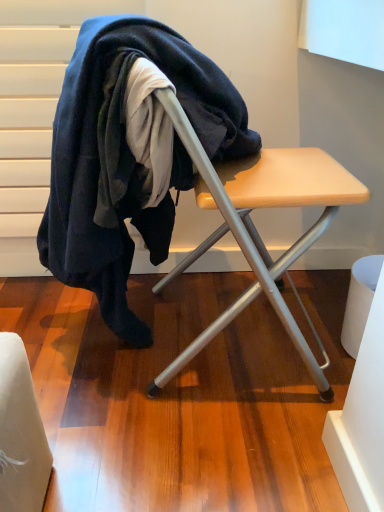
Question: Considering the relative sizes of dark blue wool at center and wooden table at center in the image provided, is dark blue wool at center taller than wooden table at center?

Choices:
 (A) yes
 (B) no

Answer: (A)

Question: From a real-world perspective, is dark blue wool at center beneath wooden table at center?

Choices:
 (A) yes
 (B) no

Answer: (B)

Question: Can you confirm if dark blue wool at center is positioned to the right of wooden table at center?

Choices:
 (A) no
 (B) yes

Answer: (A)

Question: Is dark blue wool at center thinner than wooden table at center?

Choices:
 (A) yes
 (B) no

Answer: (B)

Question: Is dark blue wool at center shorter than wooden table at center?

Choices:
 (A) no
 (B) yes

Answer: (A)

Question: Considering the relative positions of dark blue wool at center and wooden table at center in the image provided, is dark blue wool at center behind wooden table at center?

Choices:
 (A) no
 (B) yes

Answer: (B)

Question: Is wooden table at center facing away from dark blue wool at center?

Choices:
 (A) yes
 (B) no

Answer: (A)

Question: Considering the relative sizes of wooden table at center and dark blue wool at center in the image provided, is wooden table at center wider than dark blue wool at center?

Choices:
 (A) yes
 (B) no

Answer: (B)

Question: Would you consider wooden table at center to be distant from dark blue wool at center?

Choices:
 (A) no
 (B) yes

Answer: (A)

Question: Is wooden table at center closer to the viewer compared to dark blue wool at center?

Choices:
 (A) yes
 (B) no

Answer: (A)

Question: Considering the relative sizes of wooden table at center and dark blue wool at center in the image provided, is wooden table at center smaller than dark blue wool at center?

Choices:
 (A) no
 (B) yes

Answer: (B)

Question: From the image's perspective, is wooden table at center beneath dark blue wool at center?

Choices:
 (A) yes
 (B) no

Answer: (A)

Question: Considering their positions, is wooden table at center located in front of or behind dark blue wool at center?

Choices:
 (A) front
 (B) behind

Answer: (A)